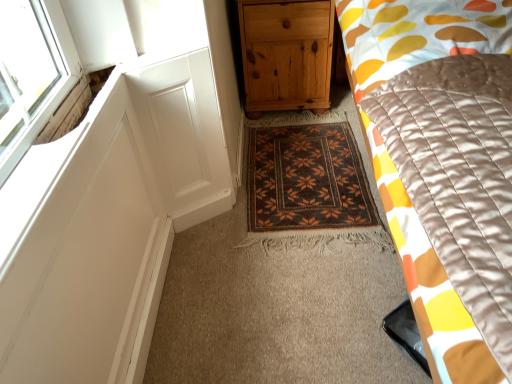
This screenshot has height=384, width=512. What do you see at coordinates (444, 165) in the screenshot? I see `silky yellow-orange quilt at right` at bounding box center [444, 165].

What is the approximate height of brown woven mat at center?

1.47 inches.

The image size is (512, 384). What are the coordinates of `natural wood chest of drawers at center` in the screenshot? It's located at (286, 54).

Is brown woven mat at center not within natural wood chest of drawers at center?

That's correct, brown woven mat at center is outside of natural wood chest of drawers at center.

Consider the image. From the image's perspective, is brown woven mat at center below natural wood chest of drawers at center?

Yes, from the image's perspective, brown woven mat at center is beneath natural wood chest of drawers at center.

From a real-world perspective, is brown woven mat at center above or below natural wood chest of drawers at center?

From a real-world perspective, brown woven mat at center is physically below natural wood chest of drawers at center.

Which is in front, point (242, 244) or point (266, 51)?

Point (242, 244)

From a real-world perspective, which is physically above, natural wood chest of drawers at center or brown woven mat at center?

natural wood chest of drawers at center, from a real-world perspective.

Measure the distance from natural wood chest of drawers at center to brown woven mat at center.

natural wood chest of drawers at center and brown woven mat at center are 16.42 inches apart from each other.

From the image's perspective, which object appears higher, natural wood chest of drawers at center or brown woven mat at center?

natural wood chest of drawers at center is shown above in the image.

Is point (267, 99) more distant than point (464, 45)?

That is True.

From a real-world perspective, is natural wood chest of drawers at center positioned above or below silky yellow-orange quilt at right?

From a real-world perspective, natural wood chest of drawers at center is physically below silky yellow-orange quilt at right.

Considering the relative sizes of natural wood chest of drawers at center and silky yellow-orange quilt at right in the image provided, is natural wood chest of drawers at center wider than silky yellow-orange quilt at right?

Incorrect, the width of natural wood chest of drawers at center does not surpass that of silky yellow-orange quilt at right.

Considering the relative sizes of natural wood chest of drawers at center and silky yellow-orange quilt at right in the image provided, is natural wood chest of drawers at center taller than silky yellow-orange quilt at right?

Incorrect, the height of natural wood chest of drawers at center is not larger of that of silky yellow-orange quilt at right.

Which of these two, silky yellow-orange quilt at right or brown woven mat at center, is wider?

With larger width is silky yellow-orange quilt at right.

Which is correct: silky yellow-orange quilt at right is inside brown woven mat at center, or outside of it?

silky yellow-orange quilt at right is spatially situated outside brown woven mat at center.

From the picture: From a real-world perspective, is silky yellow-orange quilt at right positioned above or below brown woven mat at center?

silky yellow-orange quilt at right is situated higher than brown woven mat at center in the real world.

How far apart are silky yellow-orange quilt at right and brown woven mat at center?

silky yellow-orange quilt at right is 61.31 centimeters away from brown woven mat at center.

Is brown woven mat at center oriented away from silky yellow-orange quilt at right?

No, brown woven mat at center is not facing the opposite direction of silky yellow-orange quilt at right.

Is brown woven mat at center positioned far away from silky yellow-orange quilt at right?

That's not correct — brown woven mat at center is a little close to silky yellow-orange quilt at right.

I want to click on bed located above the brown woven mat at center (from the image's perspective), so click(444, 165).

Is silky yellow-orange quilt at right far from natural wood chest of drawers at center?

No, silky yellow-orange quilt at right is not far away from natural wood chest of drawers at center.

Between silky yellow-orange quilt at right and natural wood chest of drawers at center, which one has more height?

silky yellow-orange quilt at right.

Where is `bed on the right of natural wood chest of drawers at center`? The height and width of the screenshot is (384, 512). bed on the right of natural wood chest of drawers at center is located at coordinates (444, 165).

From a real-world perspective, between silky yellow-orange quilt at right and natural wood chest of drawers at center, who is vertically higher?

From a 3D spatial view, silky yellow-orange quilt at right is above.

Where is `the chest of drawers above the brown woven mat at center (from the image's perspective)`? The width and height of the screenshot is (512, 384). the chest of drawers above the brown woven mat at center (from the image's perspective) is located at coordinates (286, 54).

In order to click on mat on the left of the natural wood chest of drawers at center in this screenshot , I will do `click(308, 189)`.

When comparing their distances from natural wood chest of drawers at center, does brown woven mat at center or silky yellow-orange quilt at right seem closer?

The object closer to natural wood chest of drawers at center is brown woven mat at center.

Which object lies nearer to the anchor point silky yellow-orange quilt at right, natural wood chest of drawers at center or brown woven mat at center?

brown woven mat at center is closer to silky yellow-orange quilt at right.

Based on their spatial positions, is silky yellow-orange quilt at right or natural wood chest of drawers at center closer to brown woven mat at center?

Based on the image, natural wood chest of drawers at center appears to be nearer to brown woven mat at center.

Which object lies further to the anchor point silky yellow-orange quilt at right, brown woven mat at center or natural wood chest of drawers at center?

Based on the image, natural wood chest of drawers at center appears to be further to silky yellow-orange quilt at right.

Estimate the real-world distances between objects in this image. Which object is closer to brown woven mat at center, natural wood chest of drawers at center or silky yellow-orange quilt at right?

natural wood chest of drawers at center lies closer to brown woven mat at center than the other object.

In the scene shown: When comparing their distances from natural wood chest of drawers at center, does silky yellow-orange quilt at right or brown woven mat at center seem closer?

brown woven mat at center is closer to natural wood chest of drawers at center.

Identify the location of mat between silky yellow-orange quilt at right and natural wood chest of drawers at center along the z-axis. (308, 189).